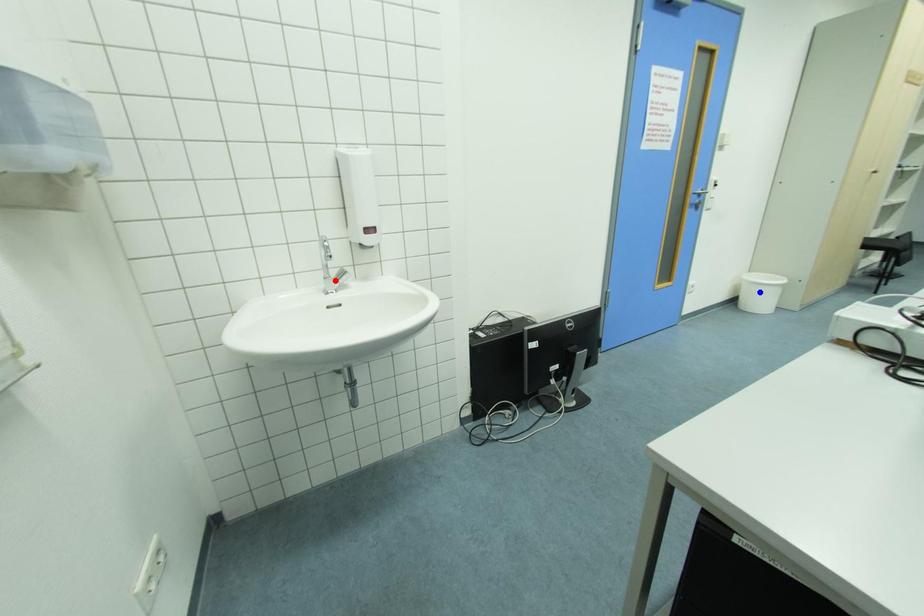
Question: Which of the two points in the image is closer to the camera?

Choices:
 (A) Blue point is closer.
 (B) Red point is closer.

Answer: (B)